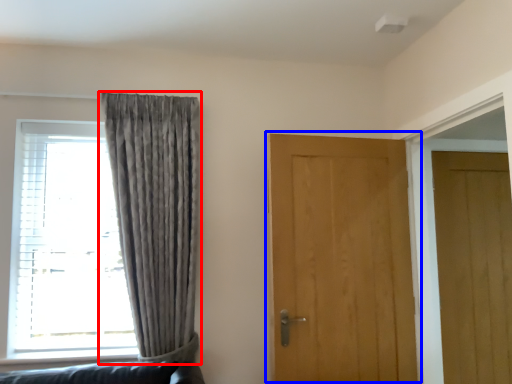
Question: Which point is further to the camera, curtain (highlighted by a red box) or door (highlighted by a blue box)?

Choices:
 (A) curtain
 (B) door

Answer: (B)